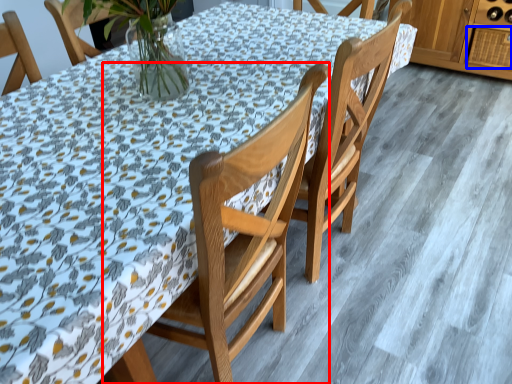
Question: Among these objects, which one is nearest to the camera, chair (highlighted by a red box) or drawer (highlighted by a blue box)?

Choices:
 (A) chair
 (B) drawer

Answer: (A)